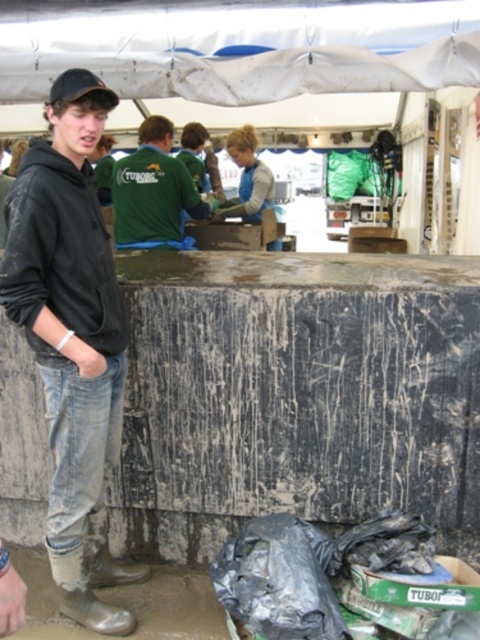
You are a photographer at the event and need to capture a clear shot of the white tarpaulin canopy at upper center without any obstructions. Is the black matte hoodie at left blocking the view of the canopy?

The black matte hoodie at left is in front of the white tarpaulin canopy at upper center, so it is blocking the view of the canopy.

You are standing at the point with coordinates (x=72, y=346) in the image. What object are you currently standing on?

The point with coordinates (x=72, y=346) is on the black matte hoodie at left.

You are organizing a clothing donation drive and need to categorize items by size. You have a black matte hoodie at left and a green fabric shirt at center. Based on their widths, which one should be placed in the larger size section?

The green fabric shirt at center should be placed in the larger size section because its width is greater than the black matte hoodie at left.